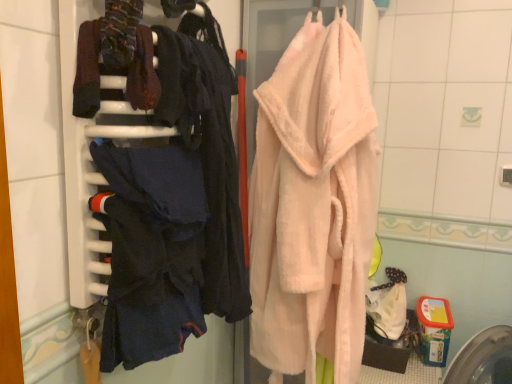
Question: Is dark blue fabric at left wider than dark blue fabric at left?

Choices:
 (A) yes
 (B) no

Answer: (B)

Question: Can dark blue fabric at left be found inside dark blue fabric at left?

Choices:
 (A) yes
 (B) no

Answer: (B)

Question: Does dark blue fabric at left have a larger size compared to dark blue fabric at left?

Choices:
 (A) yes
 (B) no

Answer: (B)

Question: Is dark blue fabric at left shorter than dark blue fabric at left?

Choices:
 (A) yes
 (B) no

Answer: (A)

Question: From a real-world perspective, is dark blue fabric at left located higher than dark blue fabric at left?

Choices:
 (A) yes
 (B) no

Answer: (B)

Question: Based on their positions, is soft pink plush bathrobe at center located to the left or right of dark blue fabric at left?

Choices:
 (A) left
 (B) right

Answer: (B)

Question: Considering the positions of point (280, 266) and point (152, 284), is point (280, 266) closer or farther from the camera than point (152, 284)?

Choices:
 (A) farther
 (B) closer

Answer: (A)

Question: Considering their positions, is soft pink plush bathrobe at center located in front of or behind dark blue fabric at left?

Choices:
 (A) behind
 (B) front

Answer: (A)

Question: From a real-world perspective, is soft pink plush bathrobe at center positioned above or below dark blue fabric at left?

Choices:
 (A) below
 (B) above

Answer: (A)

Question: Is soft pink plush bathrobe at center wider or thinner than dark blue fabric at left?

Choices:
 (A) wide
 (B) thin

Answer: (A)

Question: Does point (334, 77) appear closer or farther from the camera than point (120, 109)?

Choices:
 (A) farther
 (B) closer

Answer: (A)

Question: Is soft pink plush bathrobe at center to the left or to the right of dark blue fabric at left in the image?

Choices:
 (A) left
 (B) right

Answer: (B)

Question: Is soft pink plush bathrobe at center situated inside dark blue fabric at left or outside?

Choices:
 (A) inside
 (B) outside

Answer: (B)

Question: Considering the relative positions of dark blue fabric at left and soft pink plush bathrobe at center in the image provided, is dark blue fabric at left to the left or to the right of soft pink plush bathrobe at center?

Choices:
 (A) left
 (B) right

Answer: (A)

Question: Is dark blue fabric at left taller or shorter than soft pink plush bathrobe at center?

Choices:
 (A) short
 (B) tall

Answer: (A)